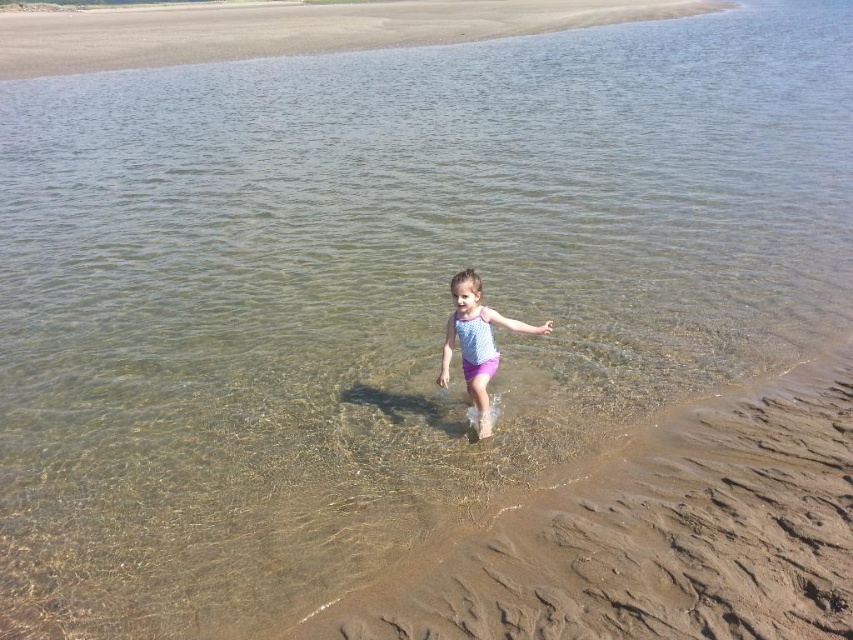
Which is more to the left, smooth sand at upper center or patterned fabric child at center?

Positioned to the left is smooth sand at upper center.

Can you confirm if smooth sand at upper center is smaller than patterned fabric child at center?

No, smooth sand at upper center is not smaller than patterned fabric child at center.

Between point (497, 32) and point (469, 301), which one is positioned behind?

The point (497, 32) is behind.

What are the coordinates of `smooth sand at upper center` in the screenshot? It's located at (289, 29).

Which is in front, point (799, 628) or point (490, 340)?

Point (799, 628)

Who is lower down, smooth brown sand at center or patterned fabric child at center?

smooth brown sand at center is below.

Is point (724, 419) closer to camera compared to point (462, 284)?

No.

The image size is (853, 640). I want to click on smooth brown sand at center, so [654, 534].

Does smooth brown sand at center have a smaller size compared to smooth sand at upper center?

Yes, smooth brown sand at center is smaller than smooth sand at upper center.

Between smooth brown sand at center and smooth sand at upper center, which one is positioned lower?

Positioned lower is smooth brown sand at center.

The height and width of the screenshot is (640, 853). I want to click on smooth brown sand at center, so click(x=654, y=534).